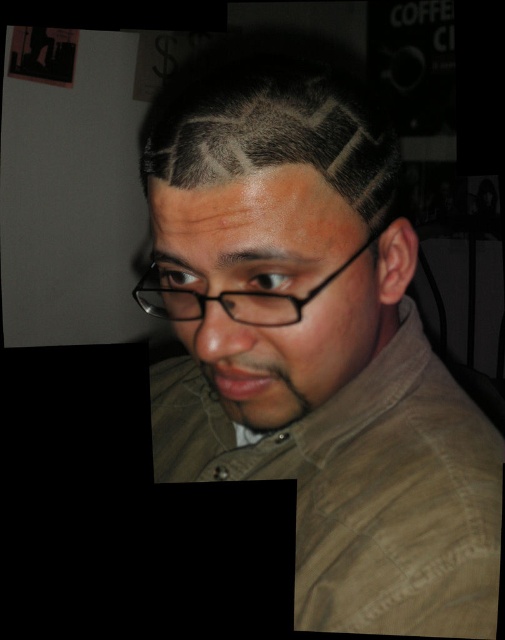
Which of these two, dark brown hair at center or dark gray hair at center, stands taller?

With more height is dark brown hair at center.

Consider the image. Can you confirm if dark brown hair at center is thinner than dark gray hair at center?

Incorrect, dark brown hair at center's width is not less than dark gray hair at center's.

Between point (177, 307) and point (273, 93), which one is positioned in front?

Point (273, 93) is in front.

I want to click on dark brown hair at center, so click(x=275, y=236).

Who is taller, dark gray hair at center or black plastic glasses at center?

dark gray hair at center is taller.

Is point (329, 106) positioned after point (149, 291)?

No, (329, 106) is in front of (149, 291).

At what (x,y) coordinates should I click in order to perform the action: click on dark gray hair at center. Please return your answer as a coordinate pair (x, y). This screenshot has height=640, width=505. Looking at the image, I should click on (273, 129).

In the scene shown: Which is more to the left, dark brown hair at center or black plastic glasses at center?

Positioned to the left is black plastic glasses at center.

Does point (157, 246) come farther from viewer compared to point (152, 294)?

No, (157, 246) is closer to viewer.

In order to click on dark brown hair at center in this screenshot , I will do `click(275, 236)`.